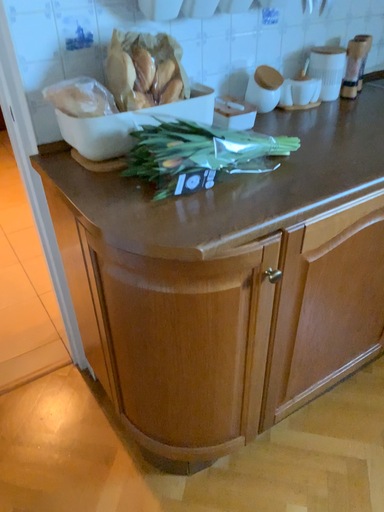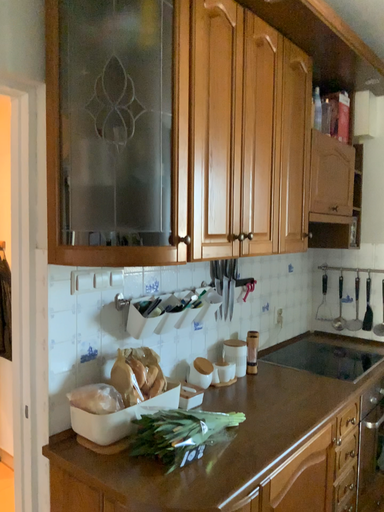
Question: Which way did the camera rotate in the video?

Choices:
 (A) rotated upward
 (B) rotated downward

Answer: (A)